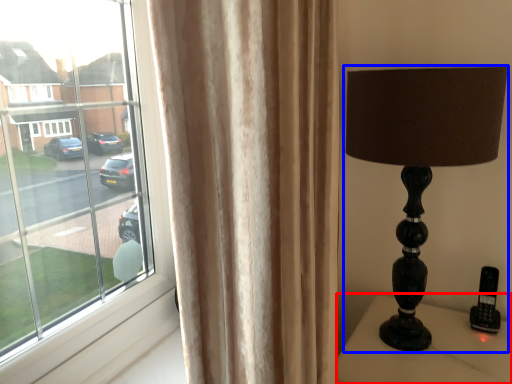
Question: Among these objects, which one is farthest to the camera, furniture (highlighted by a red box) or lamp (highlighted by a blue box)?

Choices:
 (A) furniture
 (B) lamp

Answer: (A)